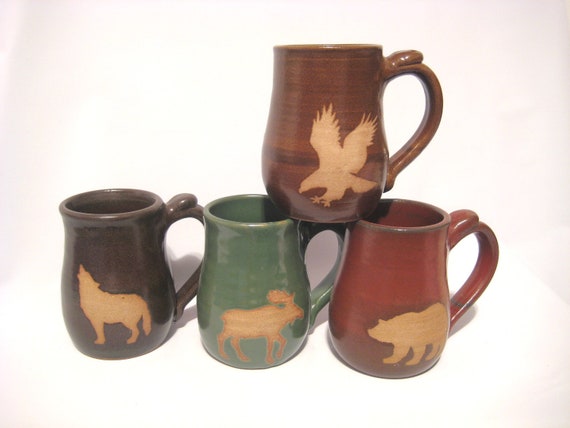
Identify the location of green mug. (272, 271).